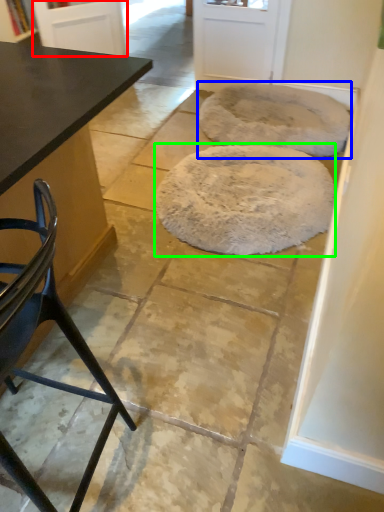
Question: Based on their relative distances, which object is farther from screen door (highlighted by a red box)? Choose from mat (highlighted by a blue box) and mat (highlighted by a green box).

Choices:
 (A) mat
 (B) mat

Answer: (B)